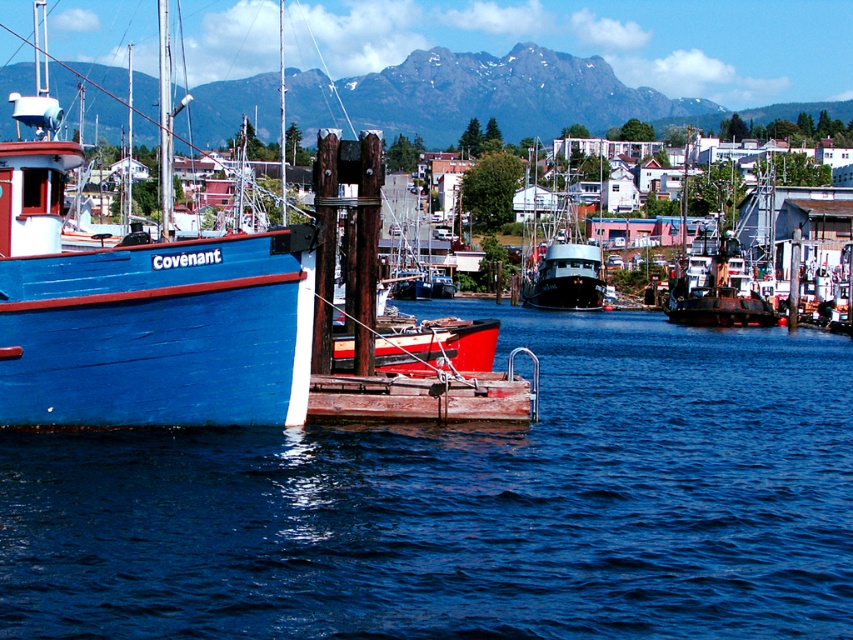
Looking at this image, does rusty wood dock at center appear on the right side of black matte boat at center?

In fact, rusty wood dock at center is to the left of black matte boat at center.

Identify the location of rusty wood dock at center. (426, 396).

Which is more to the right, matte blue wooden boat at left or rusty wood dock at center?

rusty wood dock at center

Between point (55, 396) and point (518, 385), which one is positioned behind?

The point (518, 385) is behind.

Is point (157, 419) positioned before point (345, 394)?

Yes, point (157, 419) is closer to viewer.

You are a GUI agent. You are given a task and a screenshot of the screen. Output one action in this format:
    pyautogui.click(x=<x>, y=<y>)
    Task: Click on the matte blue wooden boat at left
    The image size is (853, 640).
    Given the screenshot: What is the action you would take?
    [144, 316]

Who is more distant from viewer, (x=59, y=269) or (x=596, y=291)?

Positioned behind is point (x=596, y=291).

Does point (4, 392) lie in front of point (595, 269)?

Yes.

Which is behind, point (9, 314) or point (532, 243)?

Point (532, 243)

What are the coordinates of `matte blue wooden boat at left` in the screenshot? It's located at (144, 316).